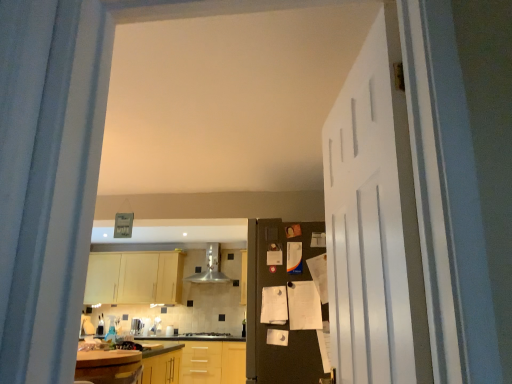
Question: Does stainless steel exhaust hood at center lie in front of wooden laminate countertop at lower left, the 1th countertop in the top-to-bottom sequence?

Choices:
 (A) no
 (B) yes

Answer: (A)

Question: Can we say stainless steel exhaust hood at center lies outside wooden laminate countertop at lower left, arranged as the second countertop when ordered from the bottom?

Choices:
 (A) no
 (B) yes

Answer: (B)

Question: Does stainless steel exhaust hood at center have a greater width compared to wooden laminate countertop at lower left, arranged as the second countertop when ordered from the bottom?

Choices:
 (A) yes
 (B) no

Answer: (B)

Question: Considering the relative positions of stainless steel exhaust hood at center and wooden laminate countertop at lower left, which ranks as the second countertop in back-to-front order, in the image provided, is stainless steel exhaust hood at center to the right of wooden laminate countertop at lower left, which ranks as the second countertop in back-to-front order, from the viewer's perspective?

Choices:
 (A) no
 (B) yes

Answer: (B)

Question: Does stainless steel exhaust hood at center have a lesser height compared to wooden laminate countertop at lower left, the first countertop viewed from the front?

Choices:
 (A) no
 (B) yes

Answer: (A)

Question: From the image's perspective, does stainless steel exhaust hood at center appear lower than wooden laminate countertop at lower left, the first countertop viewed from the front?

Choices:
 (A) yes
 (B) no

Answer: (B)

Question: Does black matte refrigerator at center, acting as the first door starting from the back, have a lesser height compared to light wood cabinet at center?

Choices:
 (A) no
 (B) yes

Answer: (A)

Question: From a real-world perspective, is black matte refrigerator at center, positioned as the 2th door in front-to-back order, beneath light wood cabinet at center?

Choices:
 (A) yes
 (B) no

Answer: (A)

Question: From the image's perspective, is black matte refrigerator at center, positioned as the 2th door in front-to-back order, located beneath light wood cabinet at center?

Choices:
 (A) yes
 (B) no

Answer: (B)

Question: Does black matte refrigerator at center, acting as the first door starting from the back, have a greater height compared to light wood cabinet at center?

Choices:
 (A) no
 (B) yes

Answer: (B)

Question: Could you tell me if black matte refrigerator at center, positioned as the 2th door in front-to-back order, is turned towards light wood cabinet at center?

Choices:
 (A) yes
 (B) no

Answer: (B)

Question: Is black matte refrigerator at center, acting as the first door starting from the back, positioned beyond the bounds of light wood cabinet at center?

Choices:
 (A) yes
 (B) no

Answer: (A)

Question: Does satin silver toaster at center have a greater height compared to wooden laminate countertop at lower left, the first countertop viewed from the front?

Choices:
 (A) yes
 (B) no

Answer: (B)